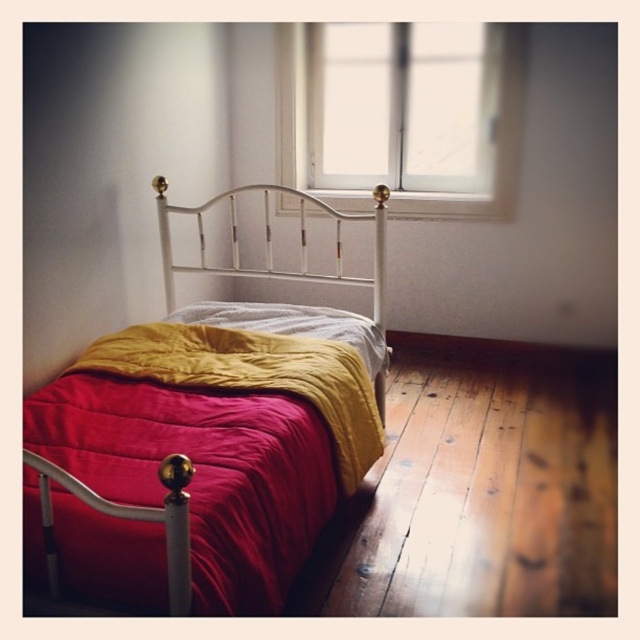
Question: Is white wooden window at upper center to the left of white metal headboard at center from the viewer's perspective?

Choices:
 (A) yes
 (B) no

Answer: (B)

Question: Which point is closer to the camera?

Choices:
 (A) velvet red blanket at center
 (B) white wooden window at upper center
 (C) matte white metal bed at center

Answer: (C)

Question: Does matte white metal bed at center appear on the left side of white metal headboard at center?

Choices:
 (A) no
 (B) yes

Answer: (A)

Question: Is matte white metal bed at center wider than velvet red blanket at center?

Choices:
 (A) yes
 (B) no

Answer: (A)

Question: Which point appears farthest from the camera in this image?

Choices:
 (A) (301, 241)
 (B) (403, 166)
 (C) (144, 435)
 (D) (234, 320)

Answer: (B)

Question: Which point is farther to the camera?

Choices:
 (A) white wooden window at upper center
 (B) white metal headboard at center
 (C) velvet red blanket at center

Answer: (A)